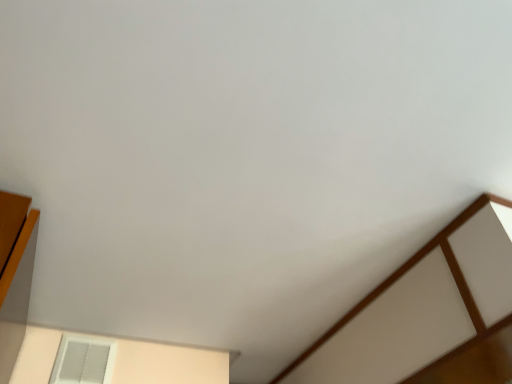
Question: Is white textured window at lower left far away from wooden paneling at right?

Choices:
 (A) yes
 (B) no

Answer: (B)

Question: From the image's perspective, does white textured window at lower left appear lower than wooden paneling at right?

Choices:
 (A) yes
 (B) no

Answer: (B)

Question: Considering the relative positions of white textured window at lower left and wooden paneling at right in the image provided, is white textured window at lower left to the left of wooden paneling at right from the viewer's perspective?

Choices:
 (A) no
 (B) yes

Answer: (B)

Question: Is white textured window at lower left in front of wooden paneling at right?

Choices:
 (A) no
 (B) yes

Answer: (A)

Question: Does white textured window at lower left have a lesser height compared to wooden paneling at right?

Choices:
 (A) no
 (B) yes

Answer: (B)

Question: Is white textured window at lower left facing towards wooden paneling at right?

Choices:
 (A) no
 (B) yes

Answer: (B)

Question: From a real-world perspective, is wooden paneling at right on white textured window at lower left?

Choices:
 (A) no
 (B) yes

Answer: (A)

Question: Is wooden paneling at right positioned in front of white textured window at lower left?

Choices:
 (A) yes
 (B) no

Answer: (A)

Question: Is wooden paneling at right aimed at white textured window at lower left?

Choices:
 (A) yes
 (B) no

Answer: (B)

Question: Is wooden paneling at right thinner than white textured window at lower left?

Choices:
 (A) no
 (B) yes

Answer: (A)

Question: Is wooden paneling at right taller than white textured window at lower left?

Choices:
 (A) yes
 (B) no

Answer: (A)

Question: Can you see wooden paneling at right touching white textured window at lower left?

Choices:
 (A) no
 (B) yes

Answer: (A)

Question: Looking at the image, does white textured window at lower left seem bigger or smaller compared to wooden paneling at right?

Choices:
 (A) big
 (B) small

Answer: (B)